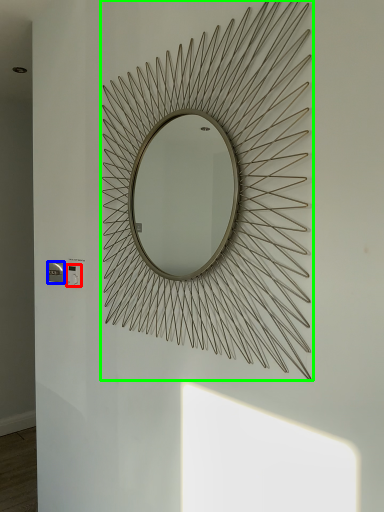
Question: Which is farther away from electric outlet (highlighted by a red box)? electric outlet (highlighted by a blue box) or mirror (highlighted by a green box)?

Choices:
 (A) electric outlet
 (B) mirror

Answer: (B)